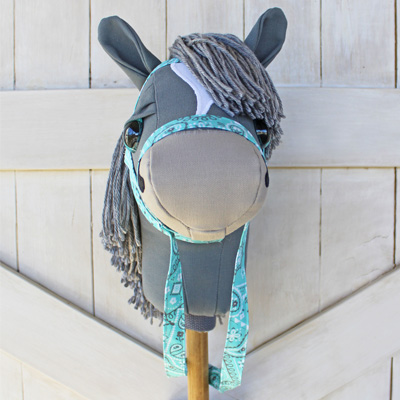
What are the coordinates of `horizontal wooden board` in the screenshot? It's located at (364, 121).